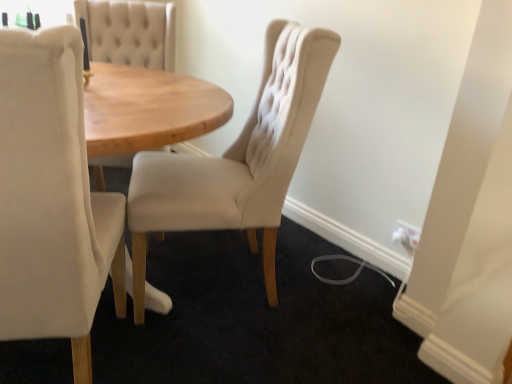
At what (x,y) coordinates should I click in order to perform the action: click on beige fabric chair at center, which is the second chair from left to right. Please return your answer as a coordinate pair (x, y). Image resolution: width=512 pixels, height=384 pixels. Looking at the image, I should click on (238, 159).

Identify the location of beige fabric chair at left, which is the 1th chair in left-to-right order. The image size is (512, 384). (52, 198).

What do you see at coordinates (52, 198) in the screenshot?
I see `beige fabric chair at left, placed as the second chair when sorted from right to left` at bounding box center [52, 198].

Identify the location of white plastic electric outlet at lower right. (407, 236).

Is beige fabric chair at center, which is the 1th chair in right-to-left order, aimed at beige fabric chair at left, which is the 1th chair in left-to-right order?

No, beige fabric chair at center, which is the 1th chair in right-to-left order, is not turned towards beige fabric chair at left, which is the 1th chair in left-to-right order.

Can we say beige fabric chair at center, which is the second chair from left to right, lies outside beige fabric chair at left, which is the 1th chair in left-to-right order?

Yes.

From the picture: Does beige fabric chair at center, which is the second chair from left to right, have a lesser height compared to beige fabric chair at left, placed as the second chair when sorted from right to left?

In fact, beige fabric chair at center, which is the second chair from left to right, may be taller than beige fabric chair at left, placed as the second chair when sorted from right to left.

Which object is positioned more to the right, beige fabric chair at center, which is the 1th chair in right-to-left order, or beige fabric chair at left, which is the 1th chair in left-to-right order?

beige fabric chair at center, which is the 1th chair in right-to-left order.

How far apart are white plastic electric outlet at lower right and beige fabric chair at left, placed as the second chair when sorted from right to left?

white plastic electric outlet at lower right is 4.43 feet from beige fabric chair at left, placed as the second chair when sorted from right to left.

Would you say white plastic electric outlet at lower right is a long distance from beige fabric chair at left, which is the 1th chair in left-to-right order?

Indeed, white plastic electric outlet at lower right is not near beige fabric chair at left, which is the 1th chair in left-to-right order.

From the image's perspective, which object appears higher, white plastic electric outlet at lower right or beige fabric chair at left, placed as the second chair when sorted from right to left?

beige fabric chair at left, placed as the second chair when sorted from right to left, appears higher in the image.

Where is `electric outlet lying behind the beige fabric chair at left, placed as the second chair when sorted from right to left`? The height and width of the screenshot is (384, 512). electric outlet lying behind the beige fabric chair at left, placed as the second chair when sorted from right to left is located at coordinates (407, 236).

Between beige fabric chair at left, placed as the second chair when sorted from right to left, and beige fabric chair at center, which is the second chair from left to right, which one appears on the right side from the viewer's perspective?

beige fabric chair at center, which is the second chair from left to right.

Considering the relative positions of beige fabric chair at left, placed as the second chair when sorted from right to left, and beige fabric chair at center, which is the 1th chair in right-to-left order, in the image provided, is beige fabric chair at left, placed as the second chair when sorted from right to left, behind beige fabric chair at center, which is the 1th chair in right-to-left order,?

No, beige fabric chair at left, placed as the second chair when sorted from right to left, is in front of beige fabric chair at center, which is the 1th chair in right-to-left order.

Is beige fabric chair at left, placed as the second chair when sorted from right to left, touching beige fabric chair at center, which is the second chair from left to right?

No, beige fabric chair at left, placed as the second chair when sorted from right to left, is not touching beige fabric chair at center, which is the second chair from left to right.

Is white plastic electric outlet at lower right positioned with its back to beige fabric chair at center, which is the second chair from left to right?

No, white plastic electric outlet at lower right is not facing away from beige fabric chair at center, which is the second chair from left to right.

Based on the photo, from a real-world perspective, is white plastic electric outlet at lower right positioned above or below beige fabric chair at center, which is the 1th chair in right-to-left order?

white plastic electric outlet at lower right is situated lower than beige fabric chair at center, which is the 1th chair in right-to-left order, in the real world.

Between white plastic electric outlet at lower right and beige fabric chair at center, which is the second chair from left to right, which one is positioned in front?

beige fabric chair at center, which is the second chair from left to right, is closer to the camera.

From a real-world perspective, which object rests below the other?

white plastic electric outlet at lower right, from a real-world perspective.

Does beige fabric chair at center, which is the 1th chair in right-to-left order, appear on the left side of white plastic electric outlet at lower right?

Correct, you'll find beige fabric chair at center, which is the 1th chair in right-to-left order, to the left of white plastic electric outlet at lower right.

Which is in front, beige fabric chair at center, which is the 1th chair in right-to-left order, or white plastic electric outlet at lower right?

beige fabric chair at center, which is the 1th chair in right-to-left order.

Is beige fabric chair at center, which is the 1th chair in right-to-left order, inside the boundaries of white plastic electric outlet at lower right, or outside?

beige fabric chair at center, which is the 1th chair in right-to-left order, is spatially situated outside white plastic electric outlet at lower right.

In the scene shown: Is beige fabric chair at left, placed as the second chair when sorted from right to left, looking in the opposite direction of white plastic electric outlet at lower right?

No, beige fabric chair at left, placed as the second chair when sorted from right to left, is not facing the opposite direction of white plastic electric outlet at lower right.

Which is correct: beige fabric chair at left, which is the 1th chair in left-to-right order, is inside white plastic electric outlet at lower right, or outside of it?

beige fabric chair at left, which is the 1th chair in left-to-right order, exists outside the volume of white plastic electric outlet at lower right.

From the image's perspective, would you say beige fabric chair at left, which is the 1th chair in left-to-right order, is shown under white plastic electric outlet at lower right?

Actually, beige fabric chair at left, which is the 1th chair in left-to-right order, appears above white plastic electric outlet at lower right in the image.

Considering the positions of objects beige fabric chair at left, placed as the second chair when sorted from right to left, and white plastic electric outlet at lower right in the image provided, who is more to the left, beige fabric chair at left, placed as the second chair when sorted from right to left, or white plastic electric outlet at lower right?

beige fabric chair at left, placed as the second chair when sorted from right to left.

Identify the location of chair located behind the beige fabric chair at left, which is the 1th chair in left-to-right order. This screenshot has width=512, height=384. (238, 159).

The image size is (512, 384). In order to click on chair that is the 2nd object to the left of the white plastic electric outlet at lower right, starting at the anchor in this screenshot , I will do `click(52, 198)`.

Looking at the image, which one is located further to white plastic electric outlet at lower right, beige fabric chair at center, which is the 1th chair in right-to-left order, or beige fabric chair at left, placed as the second chair when sorted from right to left?

beige fabric chair at left, placed as the second chair when sorted from right to left, is further to white plastic electric outlet at lower right.

Considering their positions, is white plastic electric outlet at lower right positioned further to beige fabric chair at left, placed as the second chair when sorted from right to left, than beige fabric chair at center, which is the second chair from left to right?

white plastic electric outlet at lower right.

Looking at this image, which object lies nearer to the anchor point beige fabric chair at center, which is the 1th chair in right-to-left order, beige fabric chair at left, which is the 1th chair in left-to-right order, or white plastic electric outlet at lower right?

beige fabric chair at left, which is the 1th chair in left-to-right order.

When comparing their distances from white plastic electric outlet at lower right, does beige fabric chair at left, which is the 1th chair in left-to-right order, or beige fabric chair at center, which is the second chair from left to right, seem closer?

Based on the image, beige fabric chair at center, which is the second chair from left to right, appears to be nearer to white plastic electric outlet at lower right.

When comparing their distances from beige fabric chair at center, which is the second chair from left to right, does white plastic electric outlet at lower right or beige fabric chair at left, placed as the second chair when sorted from right to left, seem further?

The object further to beige fabric chair at center, which is the second chair from left to right, is white plastic electric outlet at lower right.

Estimate the real-world distances between objects in this image. Which object is further from beige fabric chair at left, placed as the second chair when sorted from right to left, beige fabric chair at center, which is the 1th chair in right-to-left order, or white plastic electric outlet at lower right?

Among the two, white plastic electric outlet at lower right is located further to beige fabric chair at left, placed as the second chair when sorted from right to left.

What are the coordinates of `chair between beige fabric chair at left, placed as the second chair when sorted from right to left, and white plastic electric outlet at lower right from front to back` in the screenshot? It's located at (238, 159).